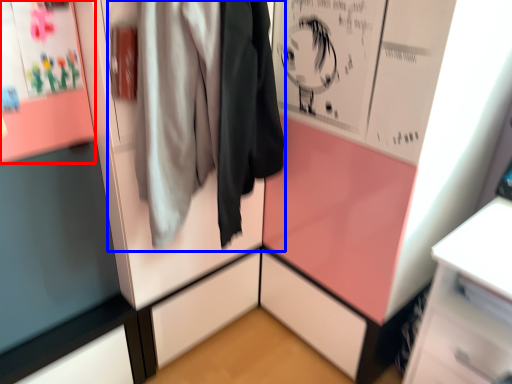
Question: Which of the following is the closest to the observer, poster page (highlighted by a red box) or jacket (highlighted by a blue box)?

Choices:
 (A) poster page
 (B) jacket

Answer: (B)